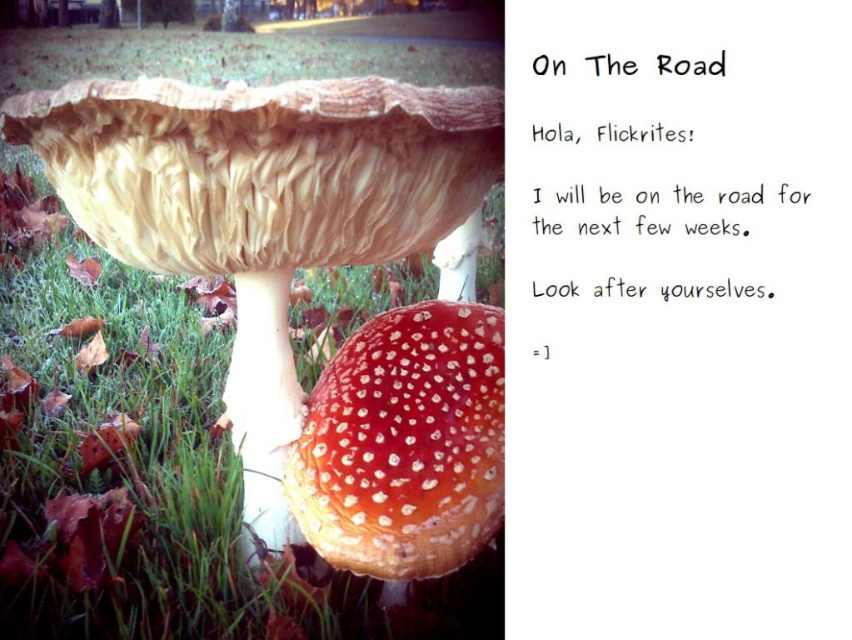
You are a gardener looking at the image of the mushrooms and grass. You need to place a small decorative rock exactly where the green grass at lower left is located. According to the coordinates provided, where should you place the rock?

The green grass at lower left is located at point (x=131, y=458), so you should place the rock at those coordinates.